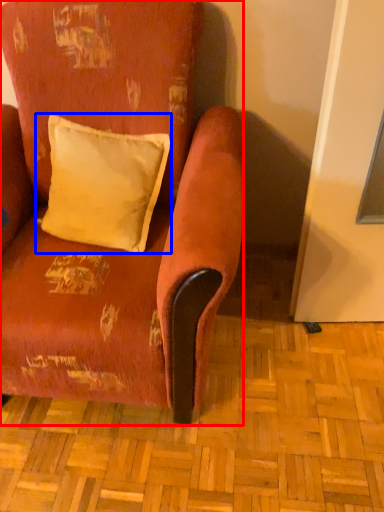
Question: Which object appears closest to the camera in this image, chair (highlighted by a red box) or pillow (highlighted by a blue box)?

Choices:
 (A) chair
 (B) pillow

Answer: (A)